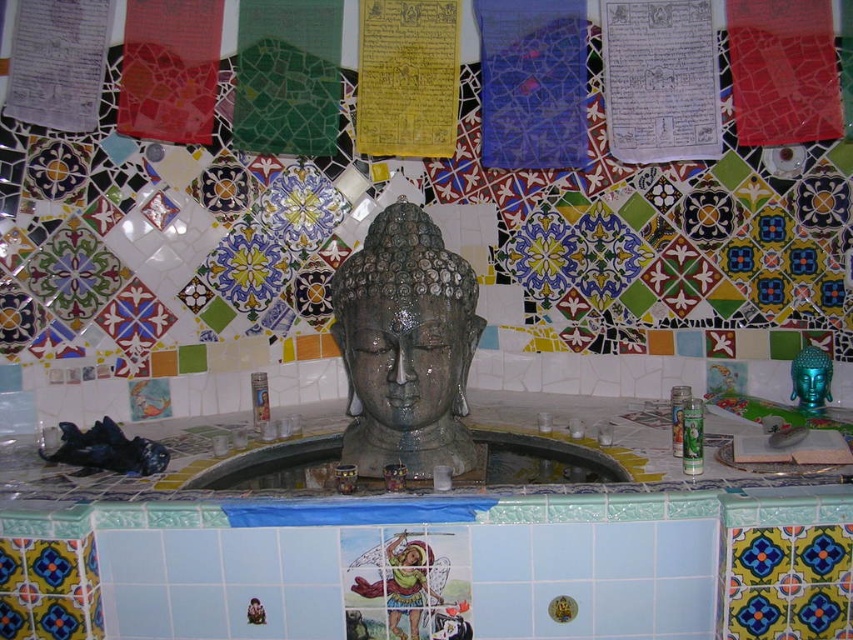
Question: Which point is farther to the camera?

Choices:
 (A) slate gray stone buddha head at center
 (B) slate stone buddha head at center

Answer: (A)

Question: Does slate stone buddha head at center have a lesser width compared to slate gray stone buddha head at center?

Choices:
 (A) no
 (B) yes

Answer: (A)

Question: Estimate the real-world distances between objects in this image. Which object is farther from the slate stone buddha head at center?

Choices:
 (A) yellow paper at upper center
 (B) slate gray stone buddha head at center

Answer: (A)

Question: From the image, what is the correct spatial relationship of slate stone buddha head at center in relation to yellow paper at upper center?

Choices:
 (A) left
 (B) right

Answer: (B)

Question: Which object appears farthest from the camera in this image?

Choices:
 (A) slate gray stone buddha head at center
 (B) slate stone buddha head at center

Answer: (A)

Question: Does slate stone buddha head at center appear under slate gray stone buddha head at center?

Choices:
 (A) yes
 (B) no

Answer: (A)